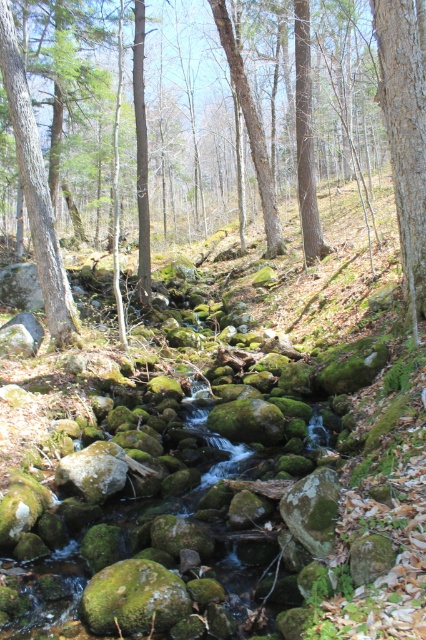
You are a hiker navigating through the forest and want to cross the stream. You notice a green mossy rock at center and a green textured tree trunk at left. Which object is positioned higher in the scene?

The green mossy rock at center is located above the green textured tree trunk at left, so it is positioned higher in the scene.